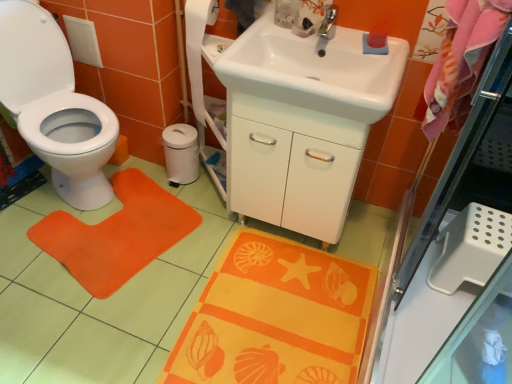
This screenshot has width=512, height=384. Describe the element at coordinates (314, 70) in the screenshot. I see `white glossy sink at upper center, the 1th sink when ordered from front to back` at that location.

This screenshot has height=384, width=512. I want to click on white matte toilet paper at center, so click(x=181, y=154).

What is the approximate width of silver metallic faucet at upper center?

silver metallic faucet at upper center is 8.27 inches in width.

Find the location of a particular element. The width and height of the screenshot is (512, 384). pink fabric beach towel at upper right is located at coordinates (461, 60).

Locate an element on the screen. The image size is (512, 384). orange fabric bath mat at lower center is located at coordinates (275, 317).

Image resolution: width=512 pixels, height=384 pixels. Describe the element at coordinates (275, 317) in the screenshot. I see `orange fabric bath mat at lower center` at that location.

Image resolution: width=512 pixels, height=384 pixels. I want to click on white glossy sink at upper center, marked as the 2th sink in a back-to-front arrangement, so [x=314, y=70].

Is orange fabric doormat at left in contact with white glossy sink at center, the first sink viewed from the back?

No, orange fabric doormat at left is not touching white glossy sink at center, the first sink viewed from the back.

Which object is closer to the camera taking this photo, orange fabric doormat at left or white glossy sink at center, the first sink viewed from the back?

white glossy sink at center, the first sink viewed from the back.

Is orange fabric doormat at left smaller than white glossy sink at center, which is counted as the 2th sink, starting from the front?

Yes.

Is orange fabric doormat at left facing away from white glossy sink at center, which is counted as the 2th sink, starting from the front?

orange fabric doormat at left is not turned away from white glossy sink at center, which is counted as the 2th sink, starting from the front.

Considering the sizes of objects orange fabric bath mat at lower center and transparent glass screen door at upper right in the image provided, who is shorter, orange fabric bath mat at lower center or transparent glass screen door at upper right?

With less height is orange fabric bath mat at lower center.

Is orange fabric bath mat at lower center in contact with transparent glass screen door at upper right?

orange fabric bath mat at lower center and transparent glass screen door at upper right are not in contact.

Considering the sizes of orange fabric bath mat at lower center and transparent glass screen door at upper right in the image, is orange fabric bath mat at lower center wider or thinner than transparent glass screen door at upper right?

In the image, orange fabric bath mat at lower center appears to be more narrow than transparent glass screen door at upper right.

Does point (216, 363) appear closer or farther from the camera than point (484, 227)?

Clearly, point (216, 363) is closer to the camera than point (484, 227).

How many degrees apart are the facing directions of orange fabric bath mat at lower center and white matte toilet paper at center?

The angle between the facing direction of orange fabric bath mat at lower center and the facing direction of white matte toilet paper at center is 91 degrees.

Can you confirm if orange fabric bath mat at lower center is smaller than white matte toilet paper at center?

No, orange fabric bath mat at lower center is not smaller than white matte toilet paper at center.

Which object is wider, orange fabric bath mat at lower center or white matte toilet paper at center?

orange fabric bath mat at lower center is wider.

Is orange fabric bath mat at lower center positioned with its back to white matte toilet paper at center?

orange fabric bath mat at lower center does not have its back to white matte toilet paper at center.

Is point (493, 24) closer to viewer compared to point (213, 378)?

Yes, it is.

Based on their sizes in the image, would you say pink fabric beach towel at upper right is bigger or smaller than orange fabric bath mat at lower center?

Considering their sizes, pink fabric beach towel at upper right takes up more space than orange fabric bath mat at lower center.

Is orange fabric bath mat at lower center a part of pink fabric beach towel at upper right?

No, pink fabric beach towel at upper right does not contain orange fabric bath mat at lower center.

Based on the photo, from a real-world perspective, which is physically above, transparent glass screen door at upper right or white matte toilet paper at center?

In real-world perspective, transparent glass screen door at upper right is above.

From the image's perspective, which is above, transparent glass screen door at upper right or white matte toilet paper at center?

From the image's view, white matte toilet paper at center is above.

Considering the relative sizes of transparent glass screen door at upper right and white matte toilet paper at center in the image provided, is transparent glass screen door at upper right shorter than white matte toilet paper at center?

No, transparent glass screen door at upper right is not shorter than white matte toilet paper at center.

Identify the location of bath mat that appears in front of the silver metallic faucet at upper center. This screenshot has height=384, width=512. (275, 317).

In the scene shown: Between orange fabric bath mat at lower center and silver metallic faucet at upper center, which one is positioned behind?

Positioned behind is silver metallic faucet at upper center.

Looking at this image, from the image's perspective, which is below, orange fabric bath mat at lower center or silver metallic faucet at upper center?

orange fabric bath mat at lower center.

Consider the image. Which of these two, orange fabric bath mat at lower center or silver metallic faucet at upper center, is bigger?

Bigger between the two is orange fabric bath mat at lower center.

From the image's perspective, is white glossy sink at upper center, marked as the 2th sink in a back-to-front arrangement, below white matte toilet paper at center?

No, from the image's perspective, white glossy sink at upper center, marked as the 2th sink in a back-to-front arrangement, is not beneath white matte toilet paper at center.

Consider the image. Which point is more distant from viewer, (387, 60) or (181, 173)?

The point (181, 173) is farther from the camera.

Based on the photo, is white glossy sink at upper center, marked as the 2th sink in a back-to-front arrangement, taller or shorter than white matte toilet paper at center?

Considering their sizes, white glossy sink at upper center, marked as the 2th sink in a back-to-front arrangement, has less height than white matte toilet paper at center.

This screenshot has height=384, width=512. I want to click on sink that is the 1st object to the right of the orange fabric doormat at left, starting at the anchor, so click(302, 122).

The height and width of the screenshot is (384, 512). I want to click on screen door above the orange fabric bath mat at lower center (from a real-world perspective), so click(457, 243).

From the image, which object appears to be nearer to white glossy sink at upper center, the 1th sink when ordered from front to back, transparent glass screen door at upper right or white glossy toilet at left?

The object closer to white glossy sink at upper center, the 1th sink when ordered from front to back, is transparent glass screen door at upper right.

Based on their spatial positions, is white glossy sink at center, which is counted as the 2th sink, starting from the front, or pink fabric beach towel at upper right closer to orange fabric bath mat at lower center?

white glossy sink at center, which is counted as the 2th sink, starting from the front, is closer to orange fabric bath mat at lower center.

From the image, which object appears to be nearer to silver metallic faucet at upper center, orange fabric bath mat at lower center or transparent glass screen door at upper right?

Based on the image, transparent glass screen door at upper right appears to be nearer to silver metallic faucet at upper center.

When comparing their distances from silver metallic faucet at upper center, does pink fabric beach towel at upper right or white glossy sink at center, which is counted as the 2th sink, starting from the front, seem further?

pink fabric beach towel at upper right is further to silver metallic faucet at upper center.

Looking at the image, which one is located closer to white glossy sink at center, which is counted as the 2th sink, starting from the front, pink fabric beach towel at upper right or orange fabric bath mat at lower center?

Among the two, pink fabric beach towel at upper right is located nearer to white glossy sink at center, which is counted as the 2th sink, starting from the front.

Estimate the real-world distances between objects in this image. Which object is further from silver metallic faucet at upper center, orange fabric bath mat at lower center or white glossy sink at center, which is counted as the 2th sink, starting from the front?

orange fabric bath mat at lower center lies further to silver metallic faucet at upper center than the other object.

From the image, which object appears to be nearer to white matte toilet paper at center, transparent glass screen door at upper right or pink fabric beach towel at upper right?

transparent glass screen door at upper right is positioned closer to the anchor white matte toilet paper at center.

Based on their spatial positions, is pink fabric beach towel at upper right or orange fabric bath mat at lower center closer to silver metallic faucet at upper center?

pink fabric beach towel at upper right is positioned closer to the anchor silver metallic faucet at upper center.

You are a GUI agent. You are given a task and a screenshot of the screen. Output one action in this format:
    pyautogui.click(x=<x>, y=<y>)
    Task: Click on the tap located between orange fabric doormat at left and pink fabric beach towel at upper right in the left-right direction
    
    Given the screenshot: What is the action you would take?
    pyautogui.click(x=326, y=29)

At what (x,y) coordinates should I click in order to perform the action: click on bath mat between white glossy toilet at left and transparent glass screen door at upper right from left to right. Please return your answer as a coordinate pair (x, y). This screenshot has width=512, height=384. Looking at the image, I should click on (275, 317).

Where is `bath mat situated between orange fabric doormat at left and white glossy sink at center, the first sink viewed from the back, from left to right`? The width and height of the screenshot is (512, 384). bath mat situated between orange fabric doormat at left and white glossy sink at center, the first sink viewed from the back, from left to right is located at coordinates (275, 317).

Locate an element on the screen. This screenshot has height=384, width=512. doormat between white glossy toilet at left and white glossy sink at upper center, marked as the 2th sink in a back-to-front arrangement, from left to right is located at coordinates (117, 234).